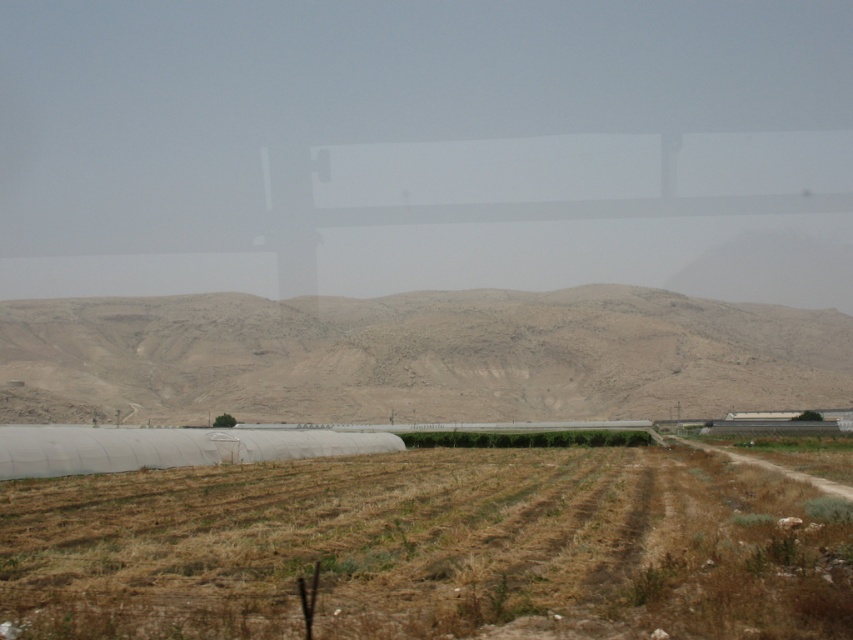
You are standing at the point marked as point (x=428, y=548) in the image. What is the immediate terrain you are standing on?

The immediate terrain at point (x=428, y=548) is the brown grassy field at lower center.